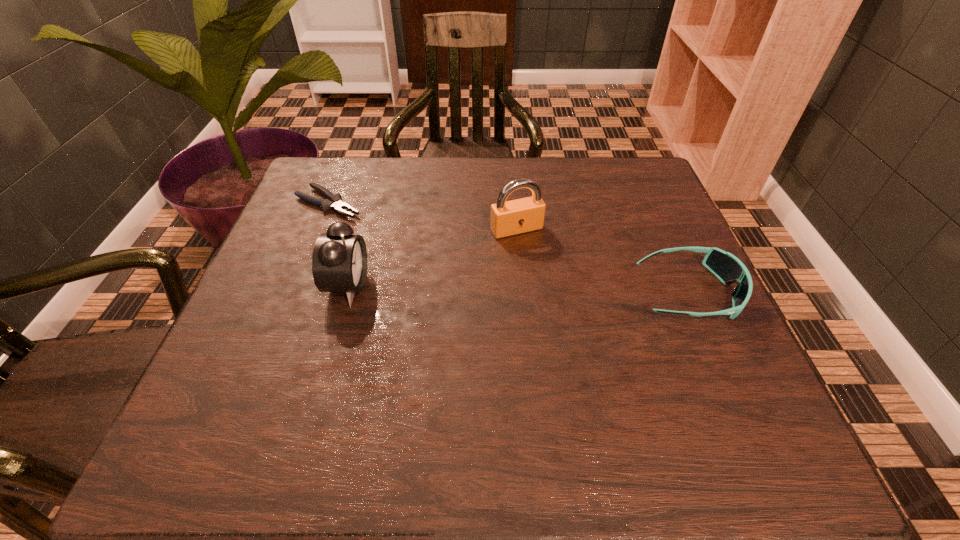
Find the location of `alarm clock`. alarm clock is located at coordinates (339, 260).

I want to click on sunglasses, so click(x=725, y=266).

At what (x,y) coordinates should I click in order to perform the action: click on the rightmost object. Please return your answer as a coordinate pair (x, y). This screenshot has height=540, width=960. Looking at the image, I should click on click(x=725, y=266).

The height and width of the screenshot is (540, 960). I want to click on padlock, so click(518, 216).

You are a GUI agent. You are given a task and a screenshot of the screen. Output one action in this format:
    pyautogui.click(x=<x>, y=<y>)
    Task: Click on the shortest object
    The height and width of the screenshot is (540, 960).
    Given the screenshot: What is the action you would take?
    pyautogui.click(x=335, y=202)

I want to click on free space located 0.160m on the front side of the alarm clock, so [444, 286].

The width and height of the screenshot is (960, 540). I want to click on free spot located to unlock the padlock from the front, so click(x=547, y=275).

The width and height of the screenshot is (960, 540). I want to click on vacant region located to unlock the padlock from the front, so tap(616, 387).

Identify the location of vacant area situated to unlock the padlock from the front. The width and height of the screenshot is (960, 540). (596, 354).

At what (x,y) coordinates should I click in order to perform the action: click on vacant position located at the gripping part of the shortest object. Please return your answer as a coordinate pair (x, y). Looking at the image, I should click on (463, 268).